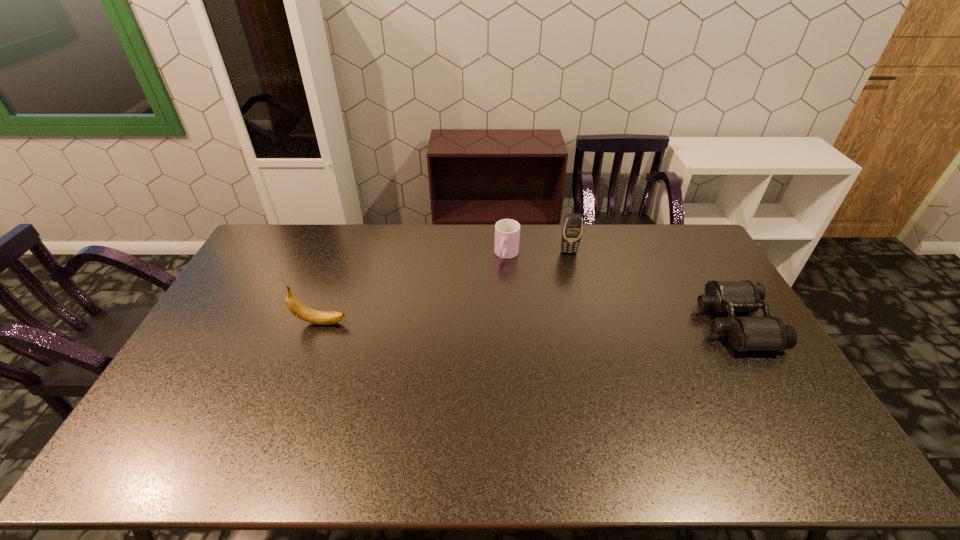
Image resolution: width=960 pixels, height=540 pixels. Find the location of `blank area located 0.360m on the front face of the second object from right to left`. blank area located 0.360m on the front face of the second object from right to left is located at coordinates (587, 326).

Where is `vacant area situated 0.140m on the front face of the second object from right to left`? Image resolution: width=960 pixels, height=540 pixels. vacant area situated 0.140m on the front face of the second object from right to left is located at coordinates (575, 280).

The height and width of the screenshot is (540, 960). Find the location of `free space located 0.160m on the front face of the second object from right to left`. free space located 0.160m on the front face of the second object from right to left is located at coordinates (576, 284).

Find the location of a particular element. The image size is (960, 540). free space located with the handle on the side of the second object from left to right is located at coordinates (473, 335).

Where is `vacant space located 0.260m with the handle on the side of the second object from left to right`? vacant space located 0.260m with the handle on the side of the second object from left to right is located at coordinates (482, 314).

Where is `free space located with the handle on the side of the second object from left to right`? The width and height of the screenshot is (960, 540). free space located with the handle on the side of the second object from left to right is located at coordinates (498, 278).

You are a GUI agent. You are given a task and a screenshot of the screen. Output one action in this format:
    pyautogui.click(x=<x>, y=<y>)
    Task: Click on the cellular telephone situated at the far edge
    
    Given the screenshot: What is the action you would take?
    pyautogui.click(x=572, y=228)

The image size is (960, 540). I want to click on cup that is at the far edge, so click(x=507, y=231).

You are a GUI agent. You are given a task and a screenshot of the screen. Output one action in this format:
    pyautogui.click(x=<x>, y=<y>)
    Task: Click on the object at the right edge
    
    Given the screenshot: What is the action you would take?
    pos(745,333)

Where is `vacant space at the far edge of the desktop`? The height and width of the screenshot is (540, 960). vacant space at the far edge of the desktop is located at coordinates 385,247.